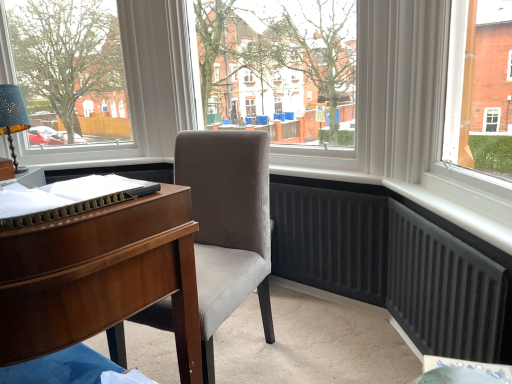
Question: From the image's perspective, is velvet grey chair at center above or below transparent glass window at center?

Choices:
 (A) above
 (B) below

Answer: (B)

Question: From a real-world perspective, is velvet grey chair at center positioned above or below transparent glass window at center?

Choices:
 (A) above
 (B) below

Answer: (B)

Question: Which object is positioned farthest from the transparent glass window at center?

Choices:
 (A) velvet grey chair at center
 (B) matte white frame at upper left
 (C) matte blue lampshade at left

Answer: (C)

Question: Estimate the real-world distances between objects in this image. Which object is closer to the velvet grey chair at center?

Choices:
 (A) matte blue lampshade at left
 (B) transparent glass window at center
 (C) matte white frame at upper left

Answer: (B)